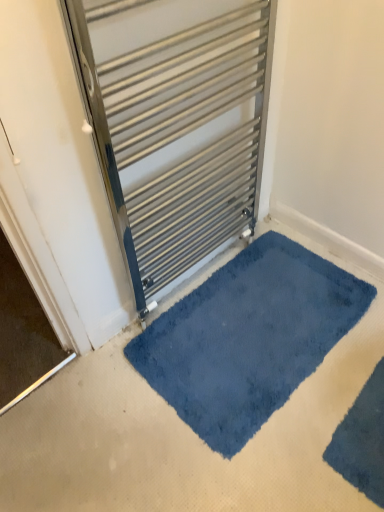
The image size is (384, 512). In order to click on free space in front of blue plush bath mat at center, which appears as the 1th bath mat when viewed from the back in this screenshot , I will do `click(272, 452)`.